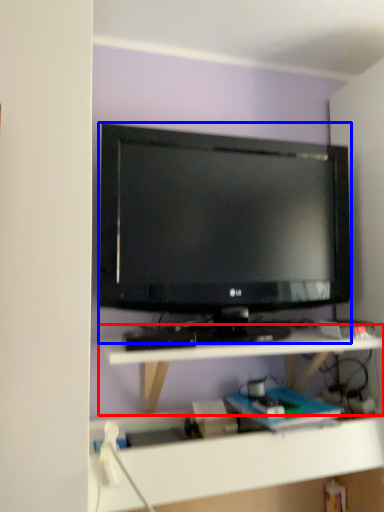
Question: Which object appears farthest to the camera in this image, shelf (highlighted by a red box) or television (highlighted by a blue box)?

Choices:
 (A) shelf
 (B) television

Answer: (B)